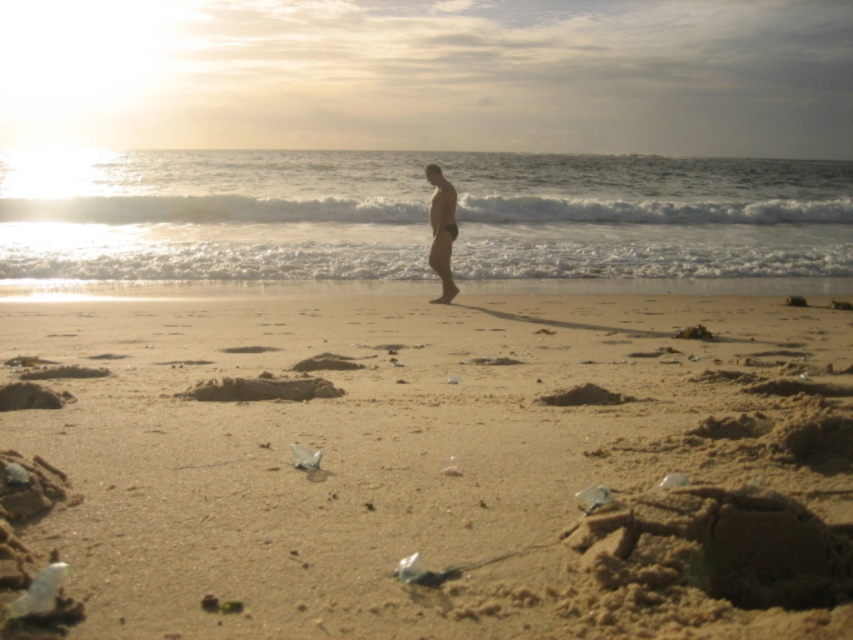
Question: Which object is farther from the camera taking this photo?

Choices:
 (A) matte black swim trunks at center
 (B) brown sandy beach at center

Answer: (A)

Question: Can you confirm if brown sandy beach at center is wider than matte black swim trunks at center?

Choices:
 (A) no
 (B) yes

Answer: (B)

Question: Does brown sandy beach at center have a greater width compared to matte black swim trunks at center?

Choices:
 (A) no
 (B) yes

Answer: (B)

Question: Is the position of brown sandy beach at center less distant than that of matte black swim trunks at center?

Choices:
 (A) no
 (B) yes

Answer: (B)